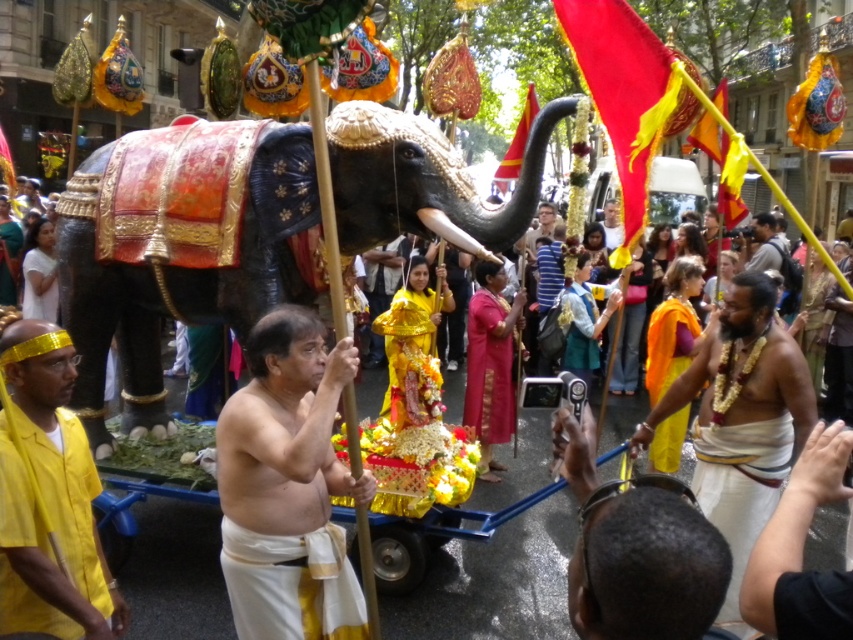
Question: Is white cloth at center positioned before light brown wooden stick at center?

Choices:
 (A) yes
 (B) no

Answer: (A)

Question: Does white silk dhoti at lower right have a greater width compared to orange silk sari at right?

Choices:
 (A) no
 (B) yes

Answer: (B)

Question: Which of the following is the closest to the observer?

Choices:
 (A) (532, 96)
 (B) (277, 403)
 (C) (764, 268)
 (D) (236, 298)

Answer: (B)

Question: Which object appears farthest from the camera in this image?

Choices:
 (A) white clothed man at lower right
 (B) red/yellow fabric flag at upper center
 (C) light brown skin at center
 (D) polished gold elephant at center

Answer: (C)

Question: Which of these objects is positioned closest to the red/yellow fabric flag at upper center?

Choices:
 (A) light brown skin at center
 (B) light brown wooden stick at center
 (C) gold beaded necklace at center
 (D) white silk dhoti at lower right

Answer: (C)

Question: Where is pink silk saree at center located in relation to smooth skin man at center in the image?

Choices:
 (A) above
 (B) below

Answer: (B)